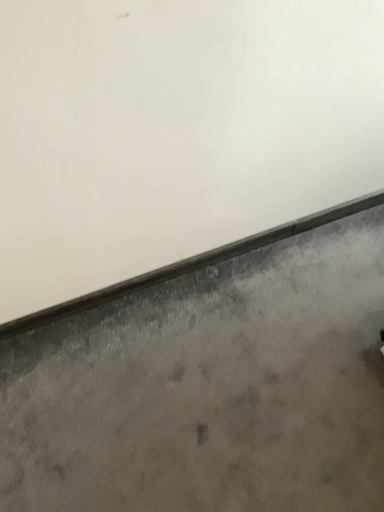
What are the coordinates of `gray concrete at bottom` in the screenshot? It's located at tap(210, 387).

The width and height of the screenshot is (384, 512). What do you see at coordinates (210, 387) in the screenshot?
I see `gray concrete at bottom` at bounding box center [210, 387].

At what (x,y) coordinates should I click in order to perform the action: click on gray concrete window sill at lower center. Please return your answer as a coordinate pair (x, y). The image size is (384, 512). Looking at the image, I should click on (191, 264).

What is the approximate width of gray concrete window sill at lower center?

1.42 inches.

This screenshot has height=512, width=384. What do you see at coordinates (191, 264) in the screenshot?
I see `gray concrete window sill at lower center` at bounding box center [191, 264].

Locate an element on the screen. gray concrete at bottom is located at coordinates (210, 387).

Considering the relative positions of gray concrete window sill at lower center and gray concrete at bottom in the image provided, is gray concrete window sill at lower center to the left of gray concrete at bottom from the viewer's perspective?

Yes, gray concrete window sill at lower center is to the left of gray concrete at bottom.

In the image, is gray concrete window sill at lower center positioned in front of or behind gray concrete at bottom?

gray concrete window sill at lower center is behind gray concrete at bottom.

Is point (26, 329) closer or farther from the camera than point (298, 412)?

Point (26, 329) is farther from the camera than point (298, 412).

From the image's perspective, is gray concrete window sill at lower center on gray concrete at bottom?

Yes, from the image's perspective, gray concrete window sill at lower center is over gray concrete at bottom.

From a real-world perspective, between gray concrete window sill at lower center and gray concrete at bottom, who is vertically lower?

From a 3D spatial view, gray concrete at bottom is below.

Does gray concrete window sill at lower center have a greater width compared to gray concrete at bottom?

Incorrect, the width of gray concrete window sill at lower center does not surpass that of gray concrete at bottom.

Between gray concrete window sill at lower center and gray concrete at bottom, which one has less height?

gray concrete at bottom is shorter.

Which of these two, gray concrete window sill at lower center or gray concrete at bottom, is smaller?

gray concrete window sill at lower center is smaller.

Could gray concrete at bottom be considered to be inside gray concrete window sill at lower center?

No, gray concrete window sill at lower center does not contain gray concrete at bottom.

Is gray concrete window sill at lower center far away from gray concrete at bottom?

No, gray concrete window sill at lower center is in close proximity to gray concrete at bottom.

Is gray concrete window sill at lower center facing towards gray concrete at bottom?

Yes.

Identify the location of concrete that is under the gray concrete window sill at lower center (from a real-world perspective). The image size is (384, 512). (210, 387).

Considering the positions of objects gray concrete at bottom and gray concrete window sill at lower center in the image provided, who is more to the right, gray concrete at bottom or gray concrete window sill at lower center?

From the viewer's perspective, gray concrete at bottom appears more on the right side.

Which object is further away from the camera taking this photo, gray concrete at bottom or gray concrete window sill at lower center?

gray concrete window sill at lower center is more distant.

Does point (6, 434) lie in front of point (272, 236)?

Yes, it is.

From the image's perspective, is gray concrete at bottom below gray concrete window sill at lower center?

Indeed, from the image's perspective, gray concrete at bottom is shown beneath gray concrete window sill at lower center.

From a real-world perspective, is gray concrete at bottom on top of gray concrete window sill at lower center?

No.

Does gray concrete at bottom have a greater width compared to gray concrete window sill at lower center?

Yes, gray concrete at bottom is wider than gray concrete window sill at lower center.

In terms of height, does gray concrete at bottom look taller or shorter compared to gray concrete window sill at lower center?

gray concrete at bottom is shorter than gray concrete window sill at lower center.

Can you confirm if gray concrete at bottom is bigger than gray concrete window sill at lower center?

Yes.

Is gray concrete at bottom not within gray concrete window sill at lower center?

Yes.

Looking at this image, is gray concrete at bottom positioned far away from gray concrete window sill at lower center?

They are positioned close to each other.

Is gray concrete at bottom oriented towards gray concrete window sill at lower center?

No.

How many degrees apart are the facing directions of gray concrete at bottom and gray concrete window sill at lower center?

The facing directions of gray concrete at bottom and gray concrete window sill at lower center are 90 degrees apart.

The image size is (384, 512). What are the coordinates of `window sill that is above the gray concrete at bottom (from a real-world perspective)` in the screenshot? It's located at (191, 264).

Find the location of `window sill that appears on the left of gray concrete at bottom`. window sill that appears on the left of gray concrete at bottom is located at coordinates (191, 264).

This screenshot has width=384, height=512. Identify the location of concrete on the right of gray concrete window sill at lower center. (210, 387).